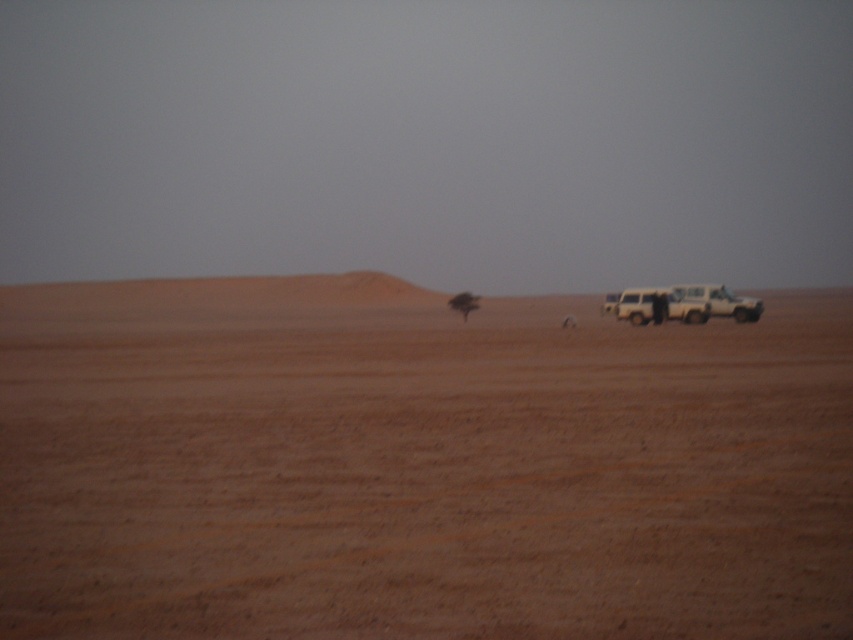
In the scene shown: Can you confirm if brown sandy dirt field at center is thinner than matte white jeep at right?

In fact, brown sandy dirt field at center might be wider than matte white jeep at right.

Between brown sandy dirt field at center and matte white jeep at right, which one is positioned higher?

matte white jeep at right

This screenshot has width=853, height=640. Describe the element at coordinates (416, 465) in the screenshot. I see `brown sandy dirt field at center` at that location.

This screenshot has width=853, height=640. I want to click on brown sandy dirt field at center, so click(x=416, y=465).